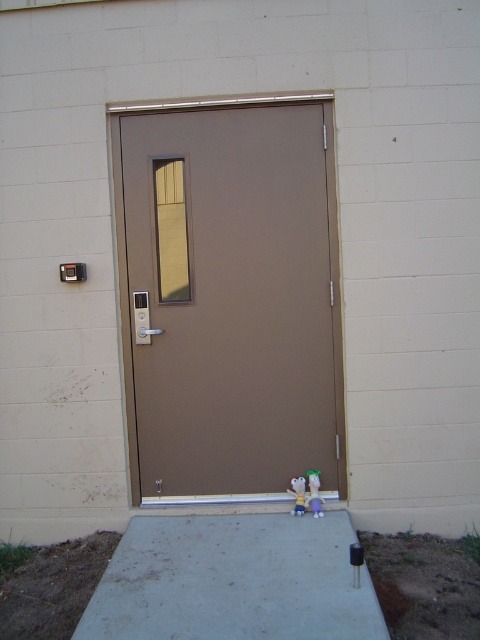
Question: Among these objects, which one is farthest from the camera?

Choices:
 (A) plush green at lower center
 (B) matte brown door at center
 (C) purple fabric toy at lower center

Answer: (A)

Question: Can you confirm if purple fabric toy at lower center is smaller than plush green at lower center?

Choices:
 (A) no
 (B) yes

Answer: (A)

Question: Is purple fabric toy at lower center in front of plush green at lower center?

Choices:
 (A) no
 (B) yes

Answer: (B)

Question: Which object appears closest to the camera in this image?

Choices:
 (A) purple fabric toy at lower center
 (B) matte brown door at center

Answer: (A)

Question: Can you confirm if purple fabric toy at lower center is positioned above plush green at lower center?

Choices:
 (A) yes
 (B) no

Answer: (A)

Question: Which of the following is the closest to the observer?

Choices:
 (A) (312, 474)
 (B) (326, 406)

Answer: (A)